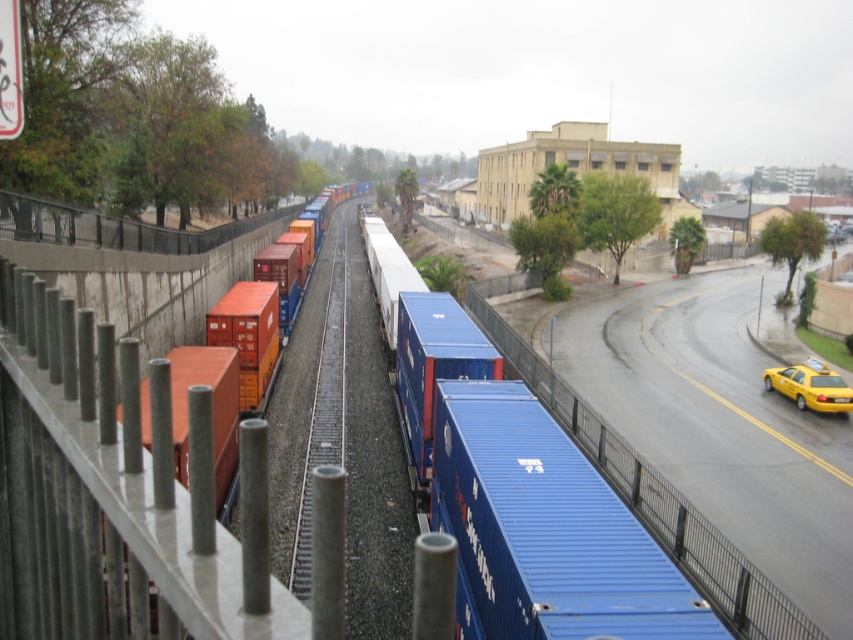
Which is behind, point (335, 282) or point (763, 381)?

The point (335, 282) is more distant.

Identify the location of blue metal train track at center. This screenshot has width=853, height=640. (323, 410).

Between point (315, 404) and point (262, 403), which one is positioned in front?

Point (262, 403) is in front.

Who is shorter, blue metal train track at center or orange matte container at center?

blue metal train track at center

Image resolution: width=853 pixels, height=640 pixels. Identify the location of blue metal train track at center. (323, 410).

Where is `blue metal train track at center`? This screenshot has height=640, width=853. blue metal train track at center is located at coordinates (323, 410).

Which is below, blue matte container at center or blue metal train track at center?

blue matte container at center is lower down.

Is blue matte container at center to the left of blue metal train track at center from the viewer's perspective?

No, blue matte container at center is not to the left of blue metal train track at center.

Describe the element at coordinates (544, 529) in the screenshot. I see `blue matte container at center` at that location.

In order to click on blue matte container at center in this screenshot , I will do `click(544, 529)`.